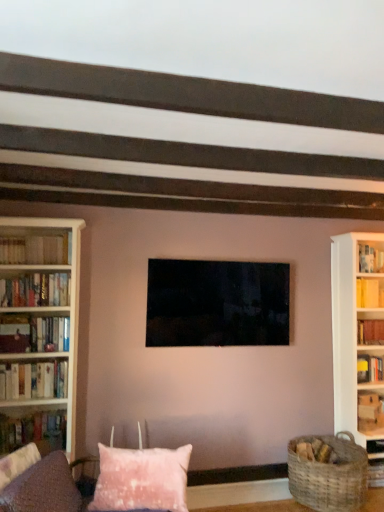
Identify the location of free area below matte black tv at center (from a real-world perspective). (233, 482).